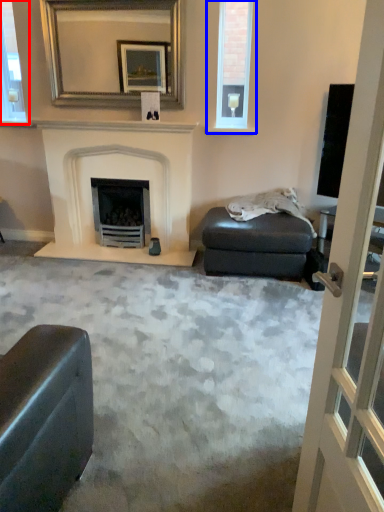
Question: Which object appears farthest to the camera in this image, window frame (highlighted by a red box) or window (highlighted by a blue box)?

Choices:
 (A) window frame
 (B) window

Answer: (A)